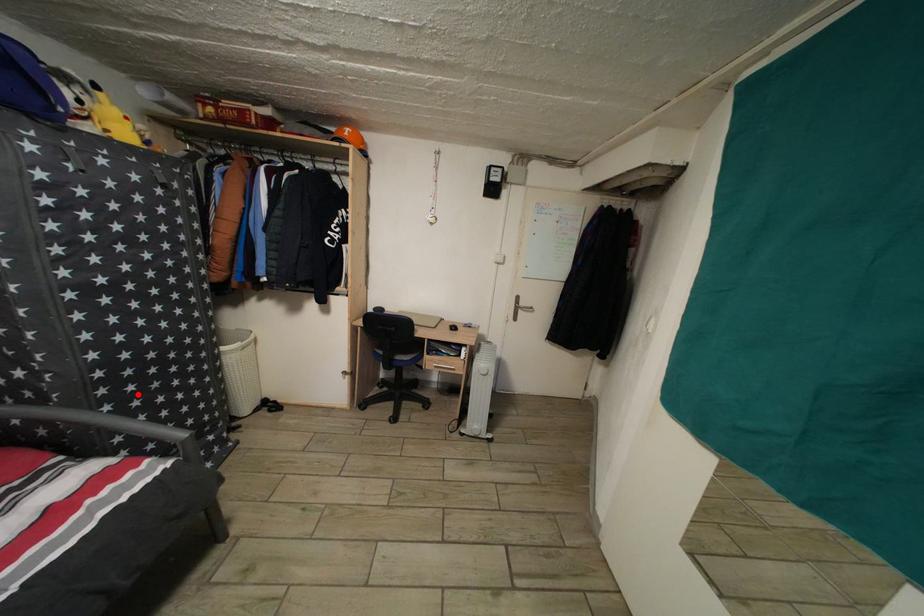
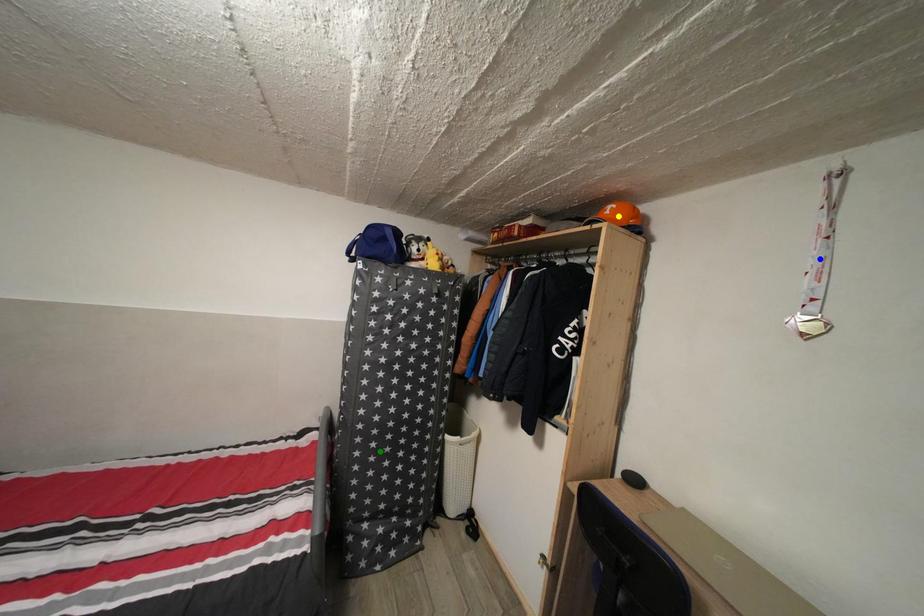
Question: I am providing you with two images of the same scene from different viewpoints. A red point is marked on the first image. You are given multiple points on the second image. Can you choose the point in image 2 that corresponds to the point in image 1?

Choices:
 (A) blue point
 (B) green point
 (C) yellow point

Answer: (B)